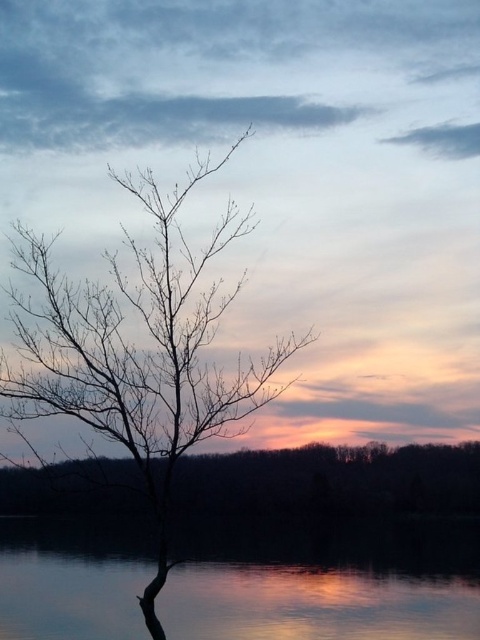
You are standing at the point with coordinates point (149, 193) and want to walk to the point with coordinates point (365, 586). However, there is an obstacle blocking your path. Based on the scene description, which direction should you move to avoid the obstacle and reach your destination?

Since point (365, 586) is behind point (149, 193), you should move around the obstacle by going either to the left or right of point (149, 193) to reach your destination.

You are standing at the edge of the water in the sunset scene. You want to place a small decorative rock exactly at the point marked as point (x=324, y=582). According to the scene description, what will the rock be placed on?

The rock will be placed on smooth water at lower center located at point (x=324, y=582).